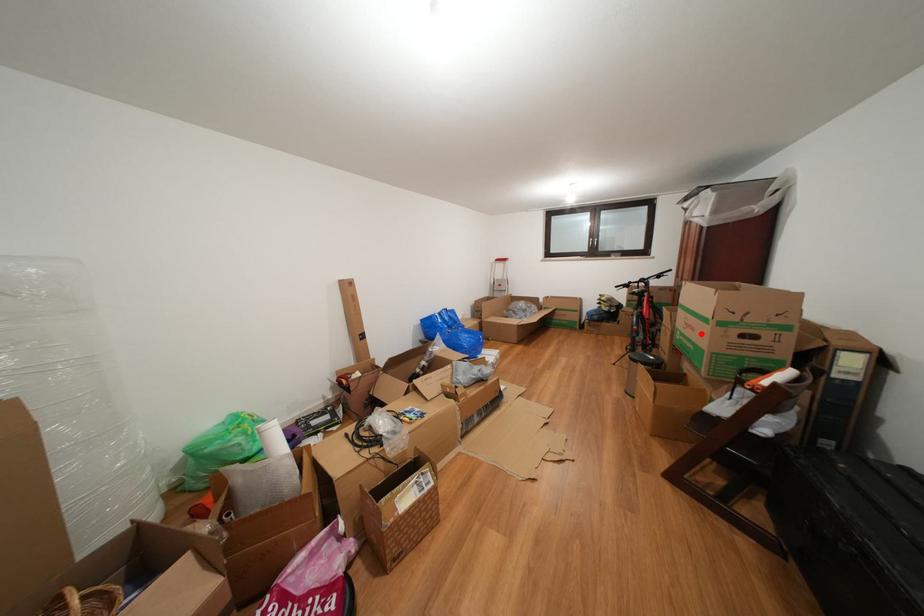
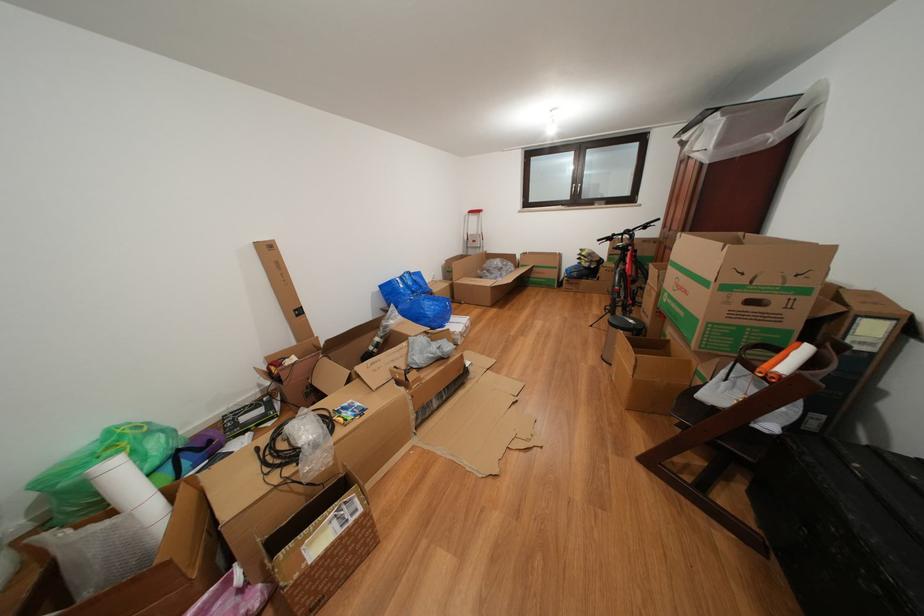
Question: I am providing you with two images of the same scene from different viewpoints. A red point is marked on the first image. At the location where the point appears in image 1, is it still visible in image 2?

Choices:
 (A) Yes
 (B) No

Answer: (A)